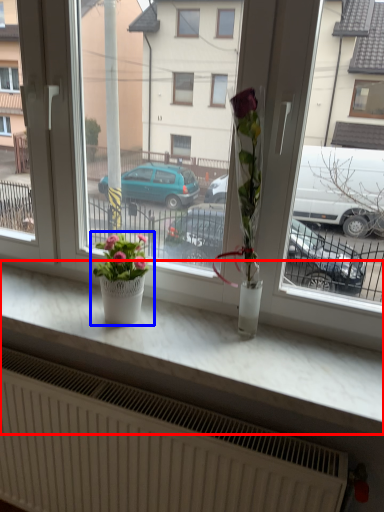
Question: Which of the following is the closest to the observer, counter top (highlighted by a red box) or houseplant (highlighted by a blue box)?

Choices:
 (A) counter top
 (B) houseplant

Answer: (A)